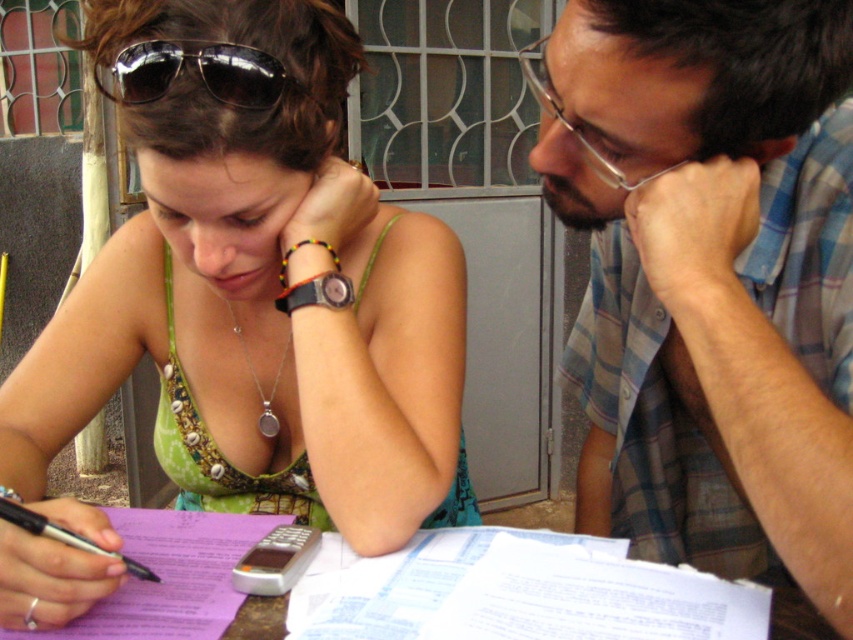
Question: Which of the following is the closest to the observer?

Choices:
 (A) (605, 177)
 (B) (660, 525)

Answer: (A)

Question: Can you confirm if black reflective sunglasses at upper center is positioned below clear plastic glasses at upper right?

Choices:
 (A) no
 (B) yes

Answer: (B)

Question: Is clear plastic glasses at upper right to the left of black plastic pen at lower left from the viewer's perspective?

Choices:
 (A) yes
 (B) no

Answer: (B)

Question: Which point is closer to the camera?

Choices:
 (A) (633, 433)
 (B) (340, 77)

Answer: (B)

Question: Which point is closer to the camera taking this photo?

Choices:
 (A) (x=759, y=608)
 (B) (x=107, y=70)

Answer: (A)

Question: Is black reflective sunglasses at upper center positioned in front of clear plastic glasses at upper right?

Choices:
 (A) no
 (B) yes

Answer: (A)